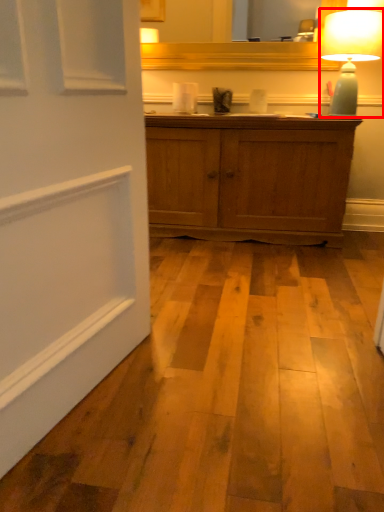
Question: From the image's perspective, considering the relative positions of table lamp (annotated by the red box) and mirror in the image provided, where is table lamp (annotated by the red box) located with respect to the staircase?

Choices:
 (A) below
 (B) above

Answer: (A)